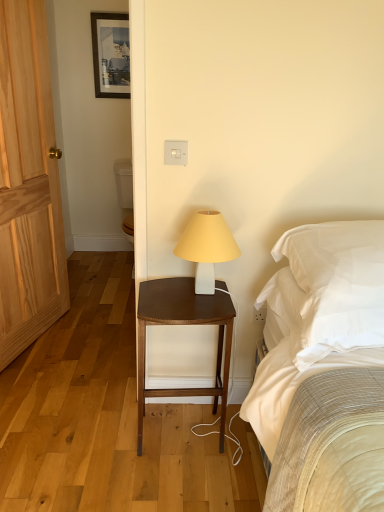
Where is `free location in front of brown wood nightstand at center`? free location in front of brown wood nightstand at center is located at coordinates click(x=181, y=485).